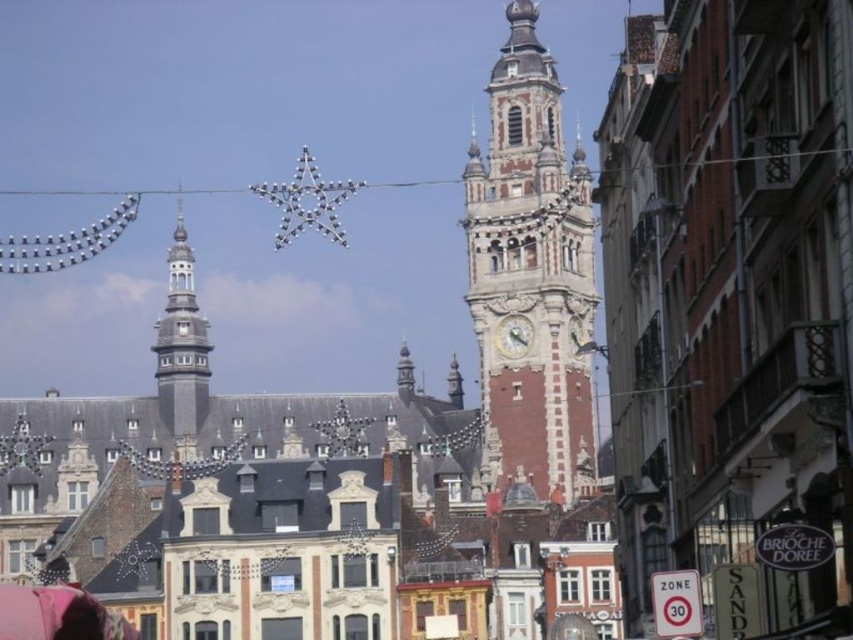
You are a city planner assessing the layout of this area. You need to install a new streetlight that must be placed equidistant between the red brick clock tower at center and the gray stone bell tower at left. Given their widths, which tower will the streetlight be closer to?

The red brick clock tower at center has a lesser width compared to the gray stone bell tower at left. Therefore, the streetlight placed equidistant between them will be closer to the red brick clock tower at center because its smaller width means the midpoint is nearer to it.